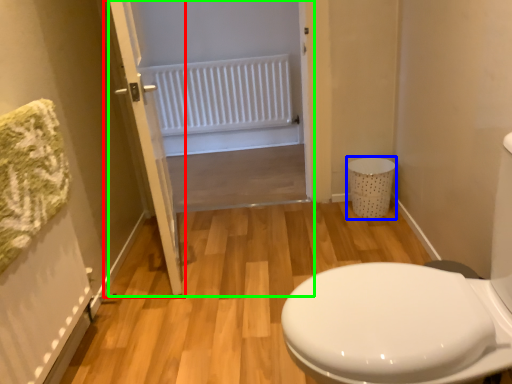
Question: Considering the real-world distances, which object is farthest from door (highlighted by a red box)? laundry basket (highlighted by a blue box) or screen door (highlighted by a green box)?

Choices:
 (A) laundry basket
 (B) screen door

Answer: (A)